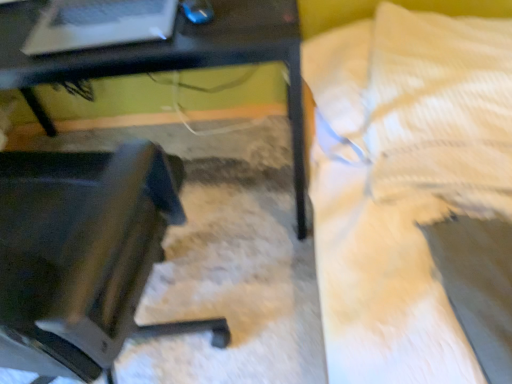
In order to face black plastic table at center, should I rotate leftwards or rightwards?

A 16.309 degree turn to the left will do.

What do you see at coordinates (405, 183) in the screenshot?
I see `white textured bed at upper right` at bounding box center [405, 183].

At what (x,y) coordinates should I click in order to perform the action: click on matte black laptop at upper left. Please return your answer as a coordinate pair (x, y). This screenshot has width=512, height=384. Looking at the image, I should click on (99, 24).

This screenshot has width=512, height=384. Describe the element at coordinates (84, 256) in the screenshot. I see `black plastic chair at lower left` at that location.

Where is `black plastic table at center`? black plastic table at center is located at coordinates (170, 58).

Considering the positions of objects white textured bed at upper right and black plastic chair at lower left in the image provided, who is more to the right, white textured bed at upper right or black plastic chair at lower left?

white textured bed at upper right is more to the right.

From a real-world perspective, is white textured bed at upper right positioned under black plastic chair at lower left based on gravity?

No, from a real-world perspective, white textured bed at upper right is not under black plastic chair at lower left.

Which object is wider, white textured bed at upper right or black plastic chair at lower left?

With larger width is black plastic chair at lower left.

Who is smaller, white textured bed at upper right or black plastic chair at lower left?

With smaller size is black plastic chair at lower left.

Considering the relative sizes of black plastic chair at lower left and black plastic table at center in the image provided, is black plastic chair at lower left thinner than black plastic table at center?

In fact, black plastic chair at lower left might be wider than black plastic table at center.

In terms of height, does black plastic chair at lower left look taller or shorter compared to black plastic table at center?

Considering their sizes, black plastic chair at lower left has less height than black plastic table at center.

Image resolution: width=512 pixels, height=384 pixels. I want to click on chair below the black plastic table at center (from a real-world perspective), so click(84, 256).

Is black plastic chair at lower left facing towards black plastic table at center?

No, black plastic chair at lower left is not oriented towards black plastic table at center.

Consider the image. Is matte black laptop at upper left looking in the opposite direction of black plastic table at center?

No, black plastic table at center is not at the back of matte black laptop at upper left.

Considering the sizes of matte black laptop at upper left and black plastic table at center in the image, is matte black laptop at upper left bigger or smaller than black plastic table at center?

matte black laptop at upper left is smaller than black plastic table at center.

Is black plastic table at center a part of matte black laptop at upper left?

Definitely not — black plastic table at center is not inside matte black laptop at upper left.

Is matte black laptop at upper left to the left of black plastic table at center from the viewer's perspective?

Incorrect, matte black laptop at upper left is not on the left side of black plastic table at center.

Is matte black laptop at upper left spatially inside white textured bed at upper right, or outside of it?

The correct answer is: outside.

Is matte black laptop at upper left oriented towards white textured bed at upper right?

No, matte black laptop at upper left is not turned towards white textured bed at upper right.

Which is behind, point (106, 34) or point (361, 295)?

Positioned behind is point (106, 34).

Between matte black laptop at upper left and white textured pillow at upper right, which one has smaller width?

With smaller width is matte black laptop at upper left.

Considering the positions of objects matte black laptop at upper left and white textured pillow at upper right in the image provided, who is in front, matte black laptop at upper left or white textured pillow at upper right?

matte black laptop at upper left is closer to the camera.

Who is taller, matte black laptop at upper left or white textured pillow at upper right?

matte black laptop at upper left is taller.

Is matte black laptop at upper left smaller than white textured pillow at upper right?

Yes.

Between black plastic table at center and white textured bed at upper right, which one has larger width?

white textured bed at upper right.

Considering the relative sizes of black plastic table at center and white textured bed at upper right in the image provided, is black plastic table at center taller than white textured bed at upper right?

Yes.

Between black plastic table at center and white textured bed at upper right, which one appears on the left side from the viewer's perspective?

Positioned to the left is black plastic table at center.

Considering the positions of point (16, 66) and point (79, 16), is point (16, 66) closer or farther from the camera than point (79, 16)?

Point (16, 66) appears to be closer to the viewer than point (79, 16).

Considering the positions of objects black plastic table at center and matte black laptop at upper left in the image provided, who is more to the right, black plastic table at center or matte black laptop at upper left?

matte black laptop at upper left.

Who is shorter, black plastic table at center or matte black laptop at upper left?

With less height is matte black laptop at upper left.

Identify the location of bed in front of the black plastic chair at lower left. The image size is (512, 384). (405, 183).

The image size is (512, 384). In order to click on chair below the black plastic table at center (from the image's perspective) in this screenshot , I will do `click(84, 256)`.

Considering their positions, is white textured pillow at upper right positioned further to matte black laptop at upper left than black plastic chair at lower left?

white textured pillow at upper right is further to matte black laptop at upper left.

Looking at the image, which one is located further to black plastic chair at lower left, white textured pillow at upper right or white textured bed at upper right?

Among the two, white textured pillow at upper right is located further to black plastic chair at lower left.

Based on their spatial positions, is black plastic chair at lower left or black plastic table at center closer to white textured pillow at upper right?

black plastic table at center is closer to white textured pillow at upper right.

Based on their spatial positions, is black plastic table at center or white textured bed at upper right further from black plastic chair at lower left?

white textured bed at upper right is further to black plastic chair at lower left.

Based on their spatial positions, is matte black laptop at upper left or white textured bed at upper right further from black plastic table at center?

Based on the image, white textured bed at upper right appears to be further to black plastic table at center.

Estimate the real-world distances between objects in this image. Which object is closer to white textured pillow at upper right, matte black laptop at upper left or black plastic table at center?

Based on the image, black plastic table at center appears to be nearer to white textured pillow at upper right.

Which object lies nearer to the anchor point matte black laptop at upper left, white textured bed at upper right or white textured pillow at upper right?

Based on the image, white textured bed at upper right appears to be nearer to matte black laptop at upper left.

Consider the image. When comparing their distances from white textured bed at upper right, does white textured pillow at upper right or matte black laptop at upper left seem closer?

The object closer to white textured bed at upper right is white textured pillow at upper right.

Locate an element on the screen. chair situated between matte black laptop at upper left and white textured bed at upper right from left to right is located at coordinates (84, 256).

The image size is (512, 384). Find the location of `chair situated between black plastic table at center and white textured bed at upper right from left to right`. chair situated between black plastic table at center and white textured bed at upper right from left to right is located at coordinates (84, 256).

Where is `table between matte black laptop at upper left and black plastic chair at lower left from top to bottom`? table between matte black laptop at upper left and black plastic chair at lower left from top to bottom is located at coordinates (170, 58).

The image size is (512, 384). In order to click on laptop between black plastic table at center and white textured pillow at upper right in this screenshot , I will do `click(99, 24)`.